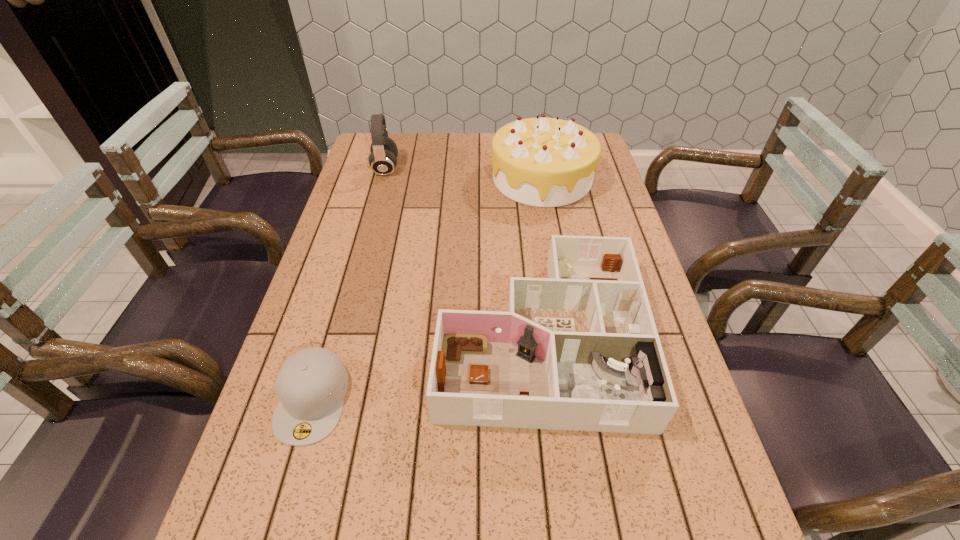
Locate an element on the screen. The width and height of the screenshot is (960, 540). unoccupied area between the cap and the birthday cake is located at coordinates (427, 288).

This screenshot has height=540, width=960. I want to click on vacant region between the second shortest object and the cap, so click(426, 368).

What are the coordinates of `free spot between the headset and the birthday cake` in the screenshot? It's located at (464, 173).

This screenshot has width=960, height=540. Identify the location of empty space between the shortest object and the headset. (349, 284).

The height and width of the screenshot is (540, 960). What are the coordinates of `object that is the closest one to the second shortest object` in the screenshot? It's located at (311, 384).

The width and height of the screenshot is (960, 540). I want to click on object that is the closest to the third tallest object, so click(x=311, y=384).

Locate an element on the screen. The image size is (960, 540). free space that satisfies the following two spatial constraints: 1. on the ear cups of the headset; 2. on the left side of the third tallest object is located at coordinates (340, 337).

Find the location of a particular element. The image size is (960, 540). vacant area that satisfies the following two spatial constraints: 1. on the ear cups of the birthday cake; 2. on the right side of the headset is located at coordinates (383, 178).

Image resolution: width=960 pixels, height=540 pixels. Find the location of `free spot that satisfies the following two spatial constraints: 1. on the ear cups of the headset; 2. on the front-facing side of the cap`. free spot that satisfies the following two spatial constraints: 1. on the ear cups of the headset; 2. on the front-facing side of the cap is located at coordinates (324, 399).

The image size is (960, 540). Find the location of `blank space that satisfies the following two spatial constraints: 1. on the ear cups of the birthday cake; 2. on the left side of the headset`. blank space that satisfies the following two spatial constraints: 1. on the ear cups of the birthday cake; 2. on the left side of the headset is located at coordinates pyautogui.click(x=383, y=178).